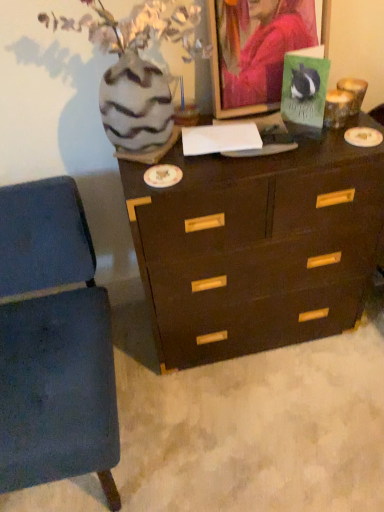
Question: Could green matte postcard at upper right be considered to be inside speckled ceramic vase at upper left?

Choices:
 (A) yes
 (B) no

Answer: (B)

Question: From a real-world perspective, is speckled ceramic vase at upper left on green matte postcard at upper right?

Choices:
 (A) yes
 (B) no

Answer: (A)

Question: Are speckled ceramic vase at upper left and green matte postcard at upper right beside each other?

Choices:
 (A) no
 (B) yes

Answer: (A)

Question: Is speckled ceramic vase at upper left turned away from green matte postcard at upper right?

Choices:
 (A) yes
 (B) no

Answer: (B)

Question: Is speckled ceramic vase at upper left taller than green matte postcard at upper right?

Choices:
 (A) yes
 (B) no

Answer: (A)

Question: Would you say speckled ceramic vase at upper left is to the left or to the right of blue fabric chair at lower left in the picture?

Choices:
 (A) left
 (B) right

Answer: (B)

Question: In terms of size, does speckled ceramic vase at upper left appear bigger or smaller than blue fabric chair at lower left?

Choices:
 (A) small
 (B) big

Answer: (A)

Question: From their relative heights in the image, would you say speckled ceramic vase at upper left is taller or shorter than blue fabric chair at lower left?

Choices:
 (A) short
 (B) tall

Answer: (A)

Question: In the image, is speckled ceramic vase at upper left positioned in front of or behind blue fabric chair at lower left?

Choices:
 (A) front
 (B) behind

Answer: (B)

Question: From the image's perspective, is matte green card at upper center located above or below dark wood chest of drawers at center?

Choices:
 (A) above
 (B) below

Answer: (A)

Question: From a real-world perspective, is matte green card at upper center above or below dark wood chest of drawers at center?

Choices:
 (A) above
 (B) below

Answer: (A)

Question: From their relative heights in the image, would you say matte green card at upper center is taller or shorter than dark wood chest of drawers at center?

Choices:
 (A) tall
 (B) short

Answer: (B)

Question: Looking at the image, does matte green card at upper center seem bigger or smaller compared to dark wood chest of drawers at center?

Choices:
 (A) small
 (B) big

Answer: (A)

Question: Considering the positions of point (233, 68) and point (4, 387), is point (233, 68) closer or farther from the camera than point (4, 387)?

Choices:
 (A) closer
 (B) farther

Answer: (B)

Question: From the image's perspective, is matte green card at upper center located above or below blue fabric chair at lower left?

Choices:
 (A) above
 (B) below

Answer: (A)